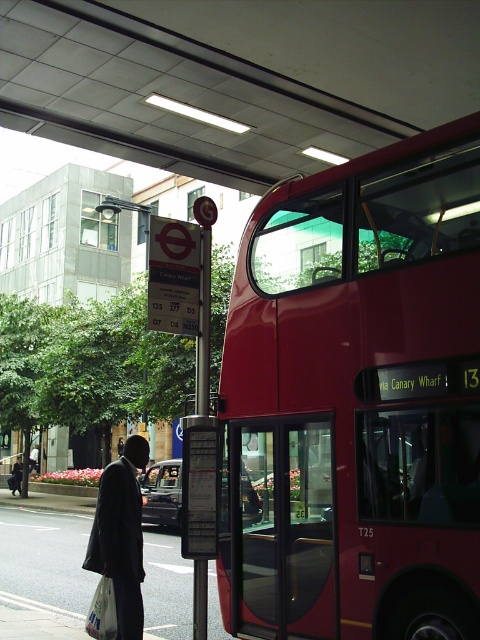
You are a fashion designer observing the scene at the bus stop. You need to create a new collection that accommodates both the dark matte suit at lower left and the white plastic bag at lower left. Which item should you prioritize in terms of width to ensure proper fit and comfort?

The dark matte suit at lower left has a smaller width than the white plastic bag at lower left. Therefore, you should prioritize designing for the wider white plastic bag at lower left to ensure adequate space and comfort for both items.

You are a delivery person who needs to place a 2.5 meter long ladder between the shiny red bus at right and the white plastic bag at lower left. Can you fit the ladder horizontally between them without bending it?

The distance between the shiny red bus at right and the white plastic bag at lower left is 2.23 meters. Since the ladder is 2.5 meters long, it cannot fit horizontally between them without bending because the space is shorter than the ladder.

You are standing at the bus stop and want to take a photo of the red double decker bus. You notice there is a point at coordinates (261, 632) which is 18.09 feet away from you. If your camera has a focal length of 50mm and you want to capture the entire bus in the frame, would you need to zoom in or out? Assume the bus is 12 feet tall and your camera sensor height is 1.5 inches.

The point at coordinates (261, 632) is 18.09 feet away. To determine if the bus fits in the frame, calculate the sensor height needed. Using the formula sensor height divided by focal length equals object height divided by distance, rearranged to sensor height needed is focal length multiplied by object height divided by distance. Plugging in 50mm, 12 feet, and 18.09 feet gives 50mm x 12ft divided by 18.09ft equals approximately 33.2mm. Since your sensor height is only 1.5 inches, which is about 38.1mm, 3